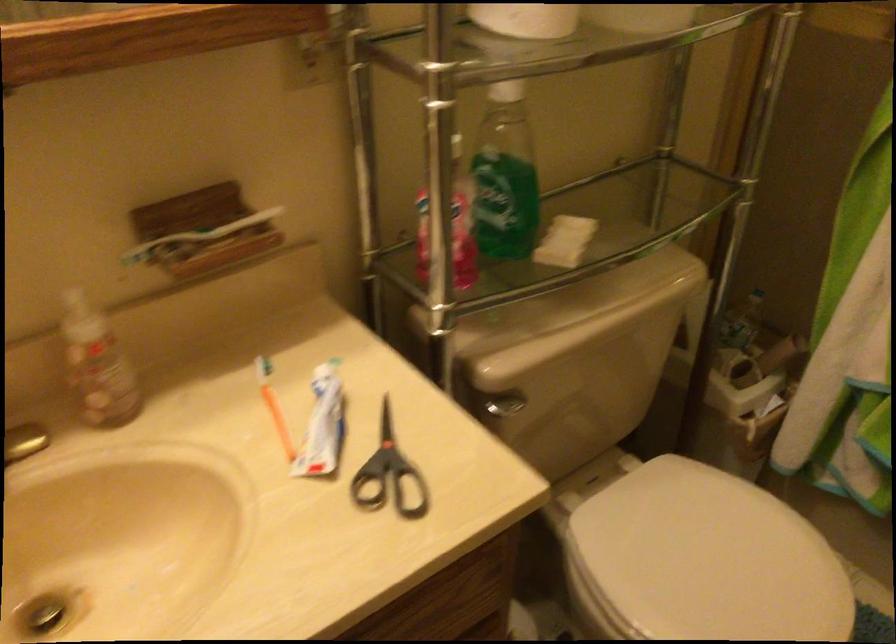
Identify the location of pink bottle. Image resolution: width=896 pixels, height=644 pixels. (449, 227).